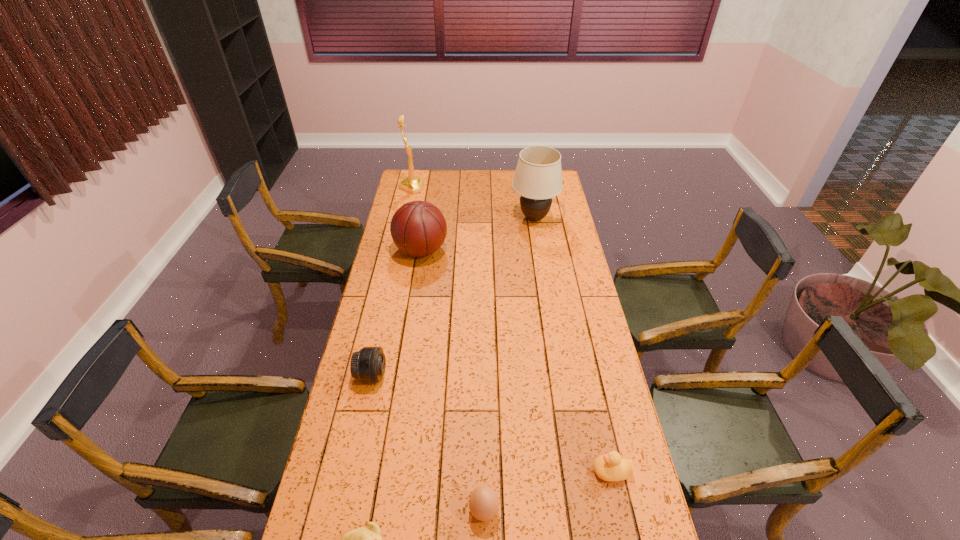
Find the location of a particular element. The width and height of the screenshot is (960, 540). duck that is at the right edge is located at coordinates (611, 467).

Identify the location of object located at the far left corner. (412, 184).

Find the location of a particular element. vacant space at the far edge of the desktop is located at coordinates (433, 174).

Where is `free space at the left edge of the desktop`? free space at the left edge of the desktop is located at coordinates coord(392,319).

Image resolution: width=960 pixels, height=540 pixels. In the image, there is a desktop. Identify the location of free space at the right edge. (628, 531).

The image size is (960, 540). Identify the location of vacant space at the far left corner of the desktop. (426, 180).

The height and width of the screenshot is (540, 960). I want to click on empty space that is in between the fourth farthest object and the lampshade, so click(x=453, y=297).

Find the location of a particular element. Image resolution: width=960 pixels, height=540 pixels. blank region between the boiled egg and the duck is located at coordinates (548, 491).

Locate an element on the screen. The image size is (960, 540). vacant area between the telephoto lens and the award is located at coordinates (392, 281).

Where is `vacant space that's between the duck and the lampshade`? This screenshot has width=960, height=540. vacant space that's between the duck and the lampshade is located at coordinates (573, 345).